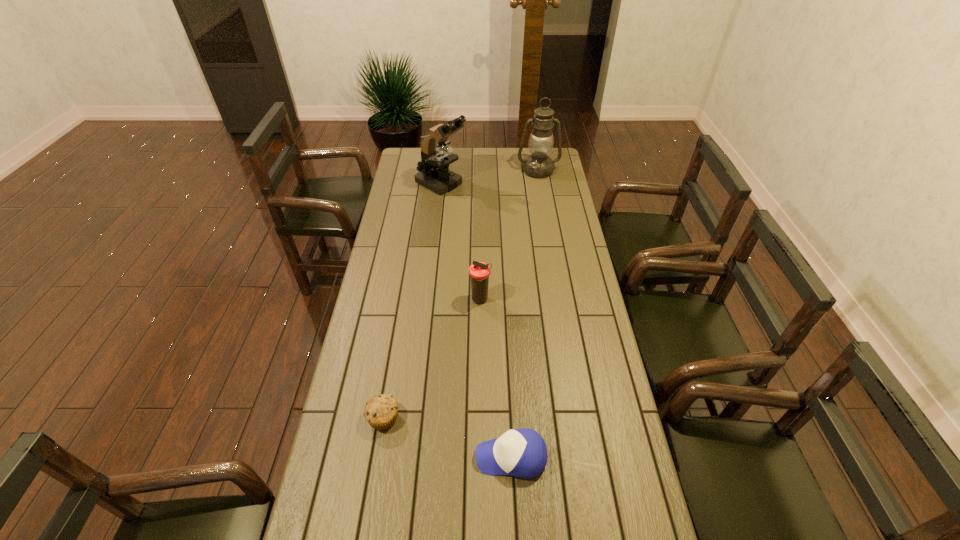
Find the location of a particular element. The image size is (960, 540). vacant area between the oil lamp and the second nearest object is located at coordinates (461, 294).

At what (x,y) coordinates should I click in order to perform the action: click on unoccupied position between the nearest object and the microscope. Please return your answer as a coordinate pair (x, y). This screenshot has width=960, height=540. Looking at the image, I should click on (476, 320).

The width and height of the screenshot is (960, 540). Identify the location of free space between the nearest object and the fourth farthest object. (447, 437).

You are a GUI agent. You are given a task and a screenshot of the screen. Output one action in this format:
    pyautogui.click(x=<x>, y=<y>)
    Task: Click on the second closest object to the oil lamp
    
    Given the screenshot: What is the action you would take?
    pyautogui.click(x=479, y=272)

Identify which object is the fourth closest to the oil lamp. Please provide its 2D coordinates. Your answer should be formatted as a tuple, i.e. [(x, y)], where the tuple contains the x and y coordinates of a point satisfying the conditions above.

[(522, 453)]